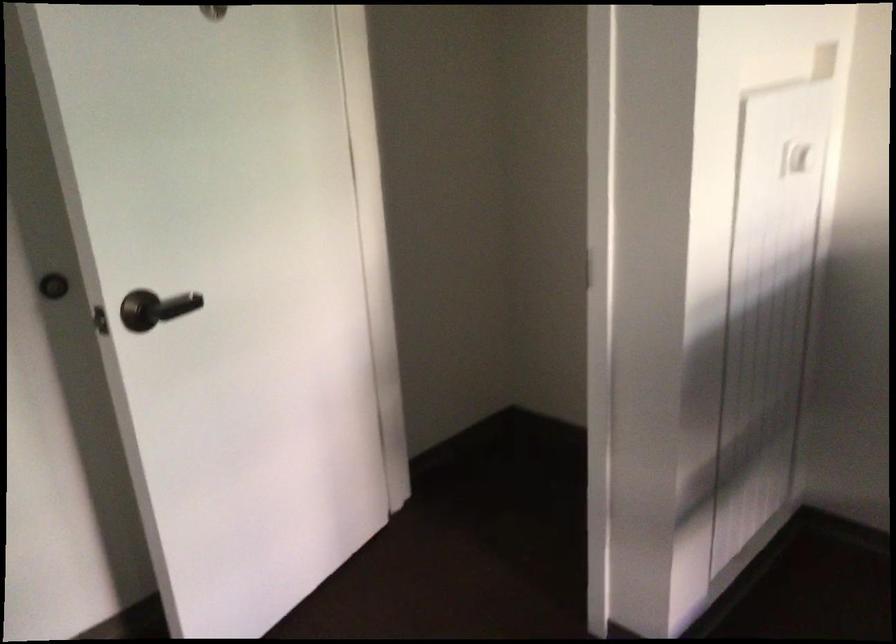
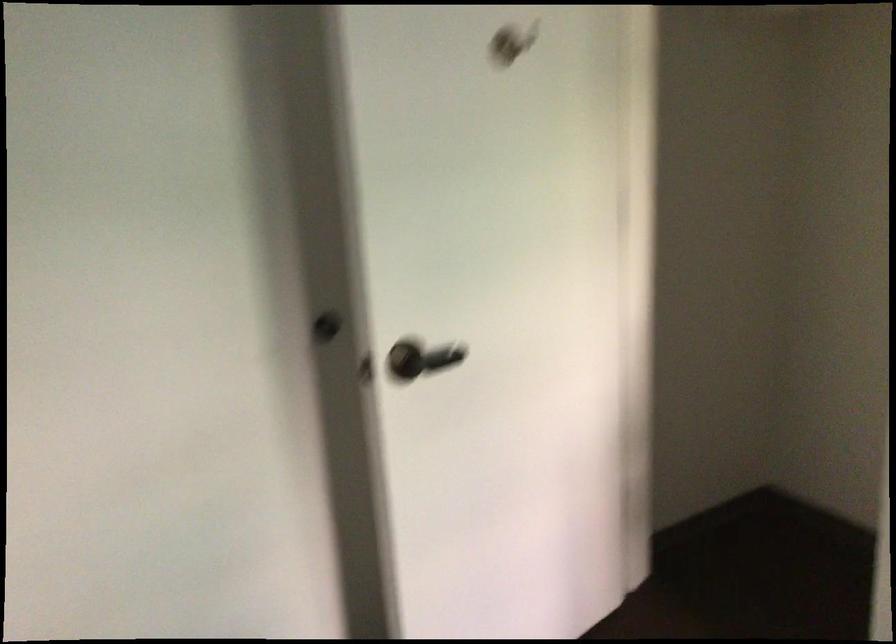
Where in the second image is the point corresponding to point 140,307 from the first image?

(407, 359)